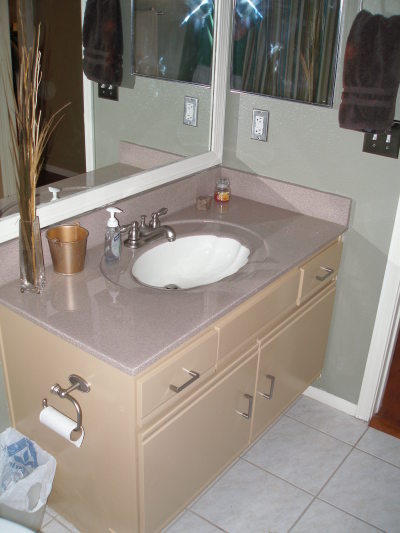
In order to click on left drawer in this screenshot , I will do `click(189, 372)`.